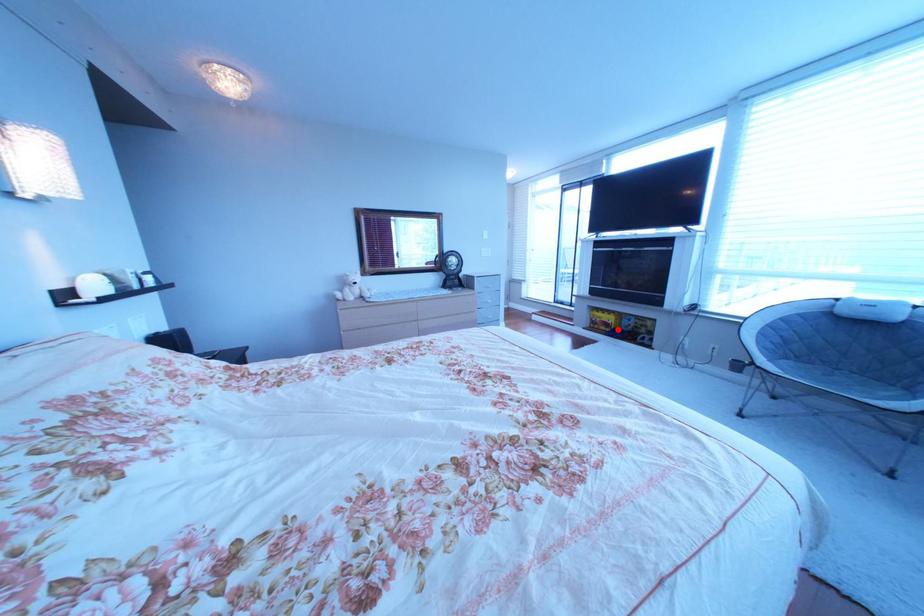
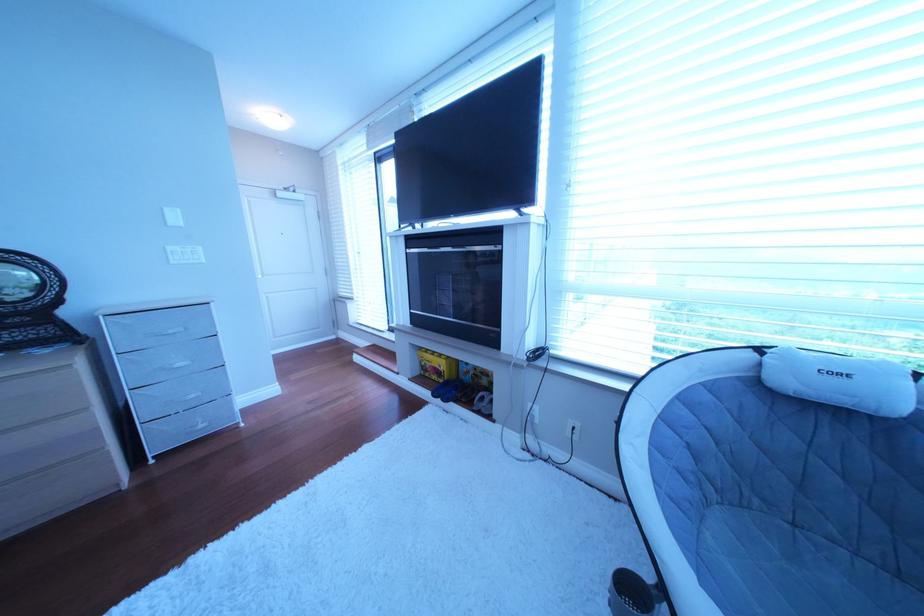
Find the pixel in the second image that matches the highlighted location in the first image.

(450, 379)